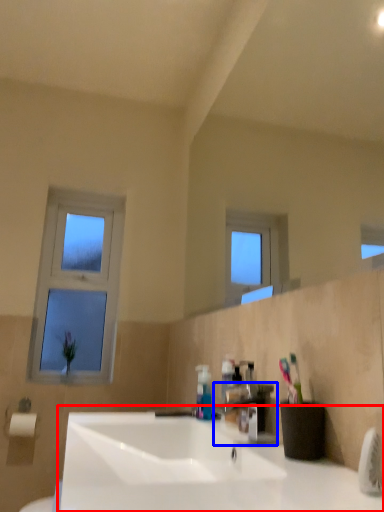
Question: Which object appears farthest to the camera in this image, sink (highlighted by a red box) or tap (highlighted by a blue box)?

Choices:
 (A) sink
 (B) tap

Answer: (B)